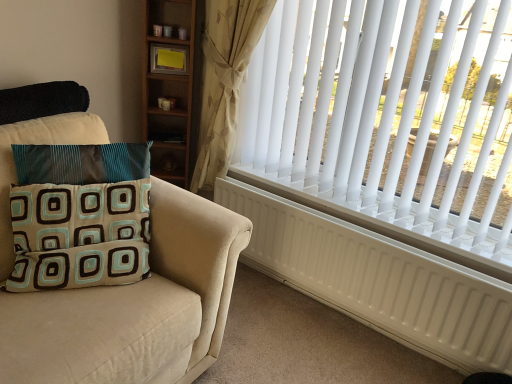
This screenshot has height=384, width=512. I want to click on teal and brown fabric pillow at left, so pos(80,216).

Identify the location of white plastic blinds at upper right. The width and height of the screenshot is (512, 384). (385, 122).

Between beige floral fabric curtain at upper right and teal and brown fabric pillow at left, which one has larger size?

beige floral fabric curtain at upper right is bigger.

Is teal and brown fabric pillow at left a part of beige floral fabric curtain at upper right?

No, beige floral fabric curtain at upper right does not contain teal and brown fabric pillow at left.

Which is farther, [234,123] or [44,289]?

The point [234,123] is farther from the camera.

Find the location of a particular element. The image size is (512, 384). curtain that appears above the teal and brown fabric pillow at left (from the image's perspective) is located at coordinates (224, 80).

From the image's perspective, which one is positioned lower, white plastic blinds at upper right or white matte radiator at right?

white matte radiator at right is shown below in the image.

Is white plastic blinds at upper right wider or thinner than white matte radiator at right?

In the image, white plastic blinds at upper right appears to be wider than white matte radiator at right.

Is white plastic blinds at upper right oriented towards white matte radiator at right?

No, white plastic blinds at upper right is not turned towards white matte radiator at right.

Considering the relative positions of white plastic blinds at upper right and white matte radiator at right in the image provided, is white plastic blinds at upper right to the right of white matte radiator at right from the viewer's perspective?

Correct, you'll find white plastic blinds at upper right to the right of white matte radiator at right.

Between point (310, 170) and point (213, 109), which one is positioned in front?

The point (213, 109) is closer to the camera.

Consider the image. From a real-world perspective, is white plastic blinds at upper right above or below beige floral fabric curtain at upper right?

From a real-world perspective, white plastic blinds at upper right is physically above beige floral fabric curtain at upper right.

Is white plastic blinds at upper right next to beige floral fabric curtain at upper right and touching it?

No, white plastic blinds at upper right is not next to beige floral fabric curtain at upper right.

From the image's perspective, would you say white plastic blinds at upper right is shown under beige floral fabric curtain at upper right?

Yes.

Is teal and brown fabric pillow at left taller or shorter than beige floral fabric curtain at upper right?

teal and brown fabric pillow at left is shorter than beige floral fabric curtain at upper right.

Can beige floral fabric curtain at upper right be found inside teal and brown fabric pillow at left?

No, beige floral fabric curtain at upper right is not inside teal and brown fabric pillow at left.

Looking at the image, does teal and brown fabric pillow at left seem bigger or smaller compared to beige floral fabric curtain at upper right?

teal and brown fabric pillow at left is smaller than beige floral fabric curtain at upper right.

Image resolution: width=512 pixels, height=384 pixels. I want to click on curtain on the right of teal and brown fabric pillow at left, so click(x=224, y=80).

Is beige floral fabric curtain at upper right completely or partially inside white matte radiator at right?

That's incorrect, beige floral fabric curtain at upper right is not inside white matte radiator at right.

Where is `radiator to the right of beige floral fabric curtain at upper right`? radiator to the right of beige floral fabric curtain at upper right is located at coordinates (377, 280).

From a real-world perspective, is white matte radiator at right over beige floral fabric curtain at upper right?

No.

Measure the distance from white matte radiator at right to beige floral fabric curtain at upper right.

A distance of 27.39 inches exists between white matte radiator at right and beige floral fabric curtain at upper right.

Does teal and brown fabric pillow at left touch white matte radiator at right?

They are not placed beside each other.

Is teal and brown fabric pillow at left shorter than white matte radiator at right?

Correct, teal and brown fabric pillow at left is not as tall as white matte radiator at right.

Is teal and brown fabric pillow at left wider or thinner than white matte radiator at right?

teal and brown fabric pillow at left is wider than white matte radiator at right.

Who is shorter, white matte radiator at right or teal and brown fabric pillow at left?

teal and brown fabric pillow at left is shorter.

From a real-world perspective, which is physically above, white matte radiator at right or teal and brown fabric pillow at left?

teal and brown fabric pillow at left is physically above.

Which object is more forward, white matte radiator at right or teal and brown fabric pillow at left?

Positioned in front is teal and brown fabric pillow at left.

Does white matte radiator at right have a larger size compared to teal and brown fabric pillow at left?

Indeed, white matte radiator at right has a larger size compared to teal and brown fabric pillow at left.

You are a GUI agent. You are given a task and a screenshot of the screen. Output one action in this format:
    pyautogui.click(x=<x>, y=<y>)
    Task: Click on the curtain on the right of teal and brown fabric pillow at left
    This screenshot has width=512, height=384.
    Given the screenshot: What is the action you would take?
    pyautogui.click(x=224, y=80)

Find the location of `radiator that appears on the left of white plastic blinds at upper right`. radiator that appears on the left of white plastic blinds at upper right is located at coordinates (377, 280).

Estimate the real-world distances between objects in this image. Which object is closer to white plastic blinds at upper right, white matte radiator at right or teal and brown fabric pillow at left?

white matte radiator at right lies closer to white plastic blinds at upper right than the other object.

When comparing their distances from beige floral fabric curtain at upper right, does teal and brown fabric pillow at left or white matte radiator at right seem further?

A: teal and brown fabric pillow at left is positioned further to the anchor beige floral fabric curtain at upper right.

Looking at this image, estimate the real-world distances between objects in this image. Which object is further from teal and brown fabric pillow at left, white matte radiator at right or white plastic blinds at upper right?

white plastic blinds at upper right is positioned further to the anchor teal and brown fabric pillow at left.

Estimate the real-world distances between objects in this image. Which object is further from white matte radiator at right, white plastic blinds at upper right or beige floral fabric curtain at upper right?

beige floral fabric curtain at upper right is further to white matte radiator at right.

Looking at this image, when comparing their distances from white plastic blinds at upper right, does beige floral fabric curtain at upper right or teal and brown fabric pillow at left seem further?

teal and brown fabric pillow at left.

Looking at the image, which one is located further to white matte radiator at right, teal and brown fabric pillow at left or beige floral fabric curtain at upper right?

teal and brown fabric pillow at left.

Estimate the real-world distances between objects in this image. Which object is further from beige floral fabric curtain at upper right, white plastic blinds at upper right or white matte radiator at right?

The object further to beige floral fabric curtain at upper right is white matte radiator at right.

When comparing their distances from white matte radiator at right, does beige floral fabric curtain at upper right or white plastic blinds at upper right seem closer?

Based on the image, white plastic blinds at upper right appears to be nearer to white matte radiator at right.

Identify the location of curtain situated between teal and brown fabric pillow at left and white plastic blinds at upper right from left to right. coord(224,80).

Identify the location of curtain between teal and brown fabric pillow at left and white matte radiator at right in the horizontal direction. (224, 80).

You are a GUI agent. You are given a task and a screenshot of the screen. Output one action in this format:
    pyautogui.click(x=<x>, y=<y>)
    Task: Click on the radiator between teal and brown fabric pillow at left and white plastic blinds at upper right in the horizontal direction
    
    Given the screenshot: What is the action you would take?
    pyautogui.click(x=377, y=280)

I want to click on window blind between beige floral fabric curtain at upper right and white matte radiator at right in the up-down direction, so click(385, 122).